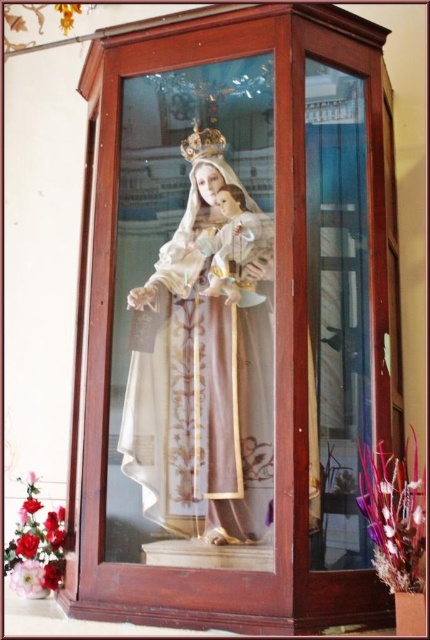
You are an interior designer assessing the placement of the statue in the cabinet. Based on the statue of the Virgin Mary holding the infant Jesus, which object, the matte gold robe at center or the gold metallic crown at upper center, would you say is positioned higher up in the visual hierarchy?

The matte gold robe at center is taller than the gold metallic crown at upper center, so the matte gold robe at center is positioned higher up in the visual hierarchy.

You are an art conservator examining the display cabinet. You notice the matte gold robe at center and the gold metallic crown at upper center. Which object is positioned closer to the front of the cabinet?

The matte gold robe at center is closer to the viewer than the gold metallic crown at upper center, so the matte gold robe at center is positioned closer to the front of the cabinet.

From the picture: You are an art conservator examining the statue in the display cabinet. You need to determine which object, the matte gold robe at center or the gold metallic crown at upper center, requires more space for preservation. Based on their sizes, which one should you prioritize?

The matte gold robe at center is larger in size than the gold metallic crown at upper center, so it requires more space for preservation and should be prioritized.